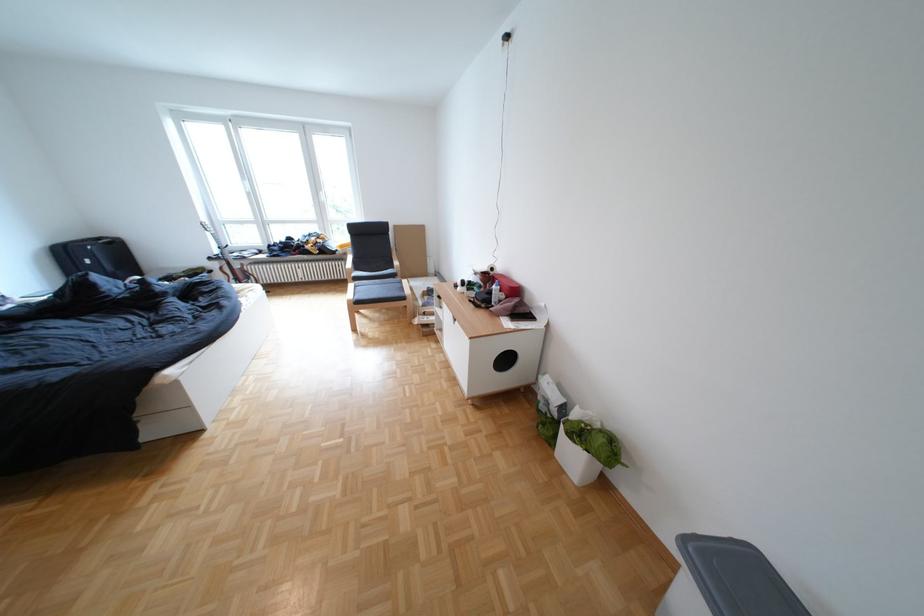
Find where to lift the brown acoustic guitar. Please return your answer as a coordinate pair (x, y).

(228, 257)